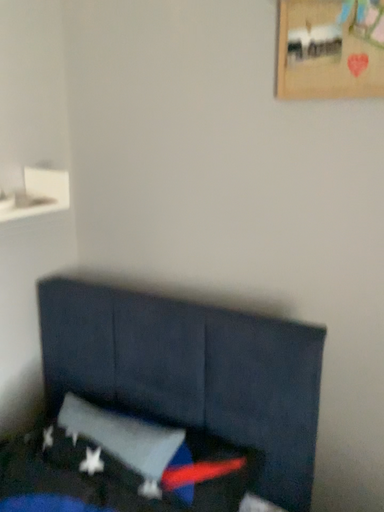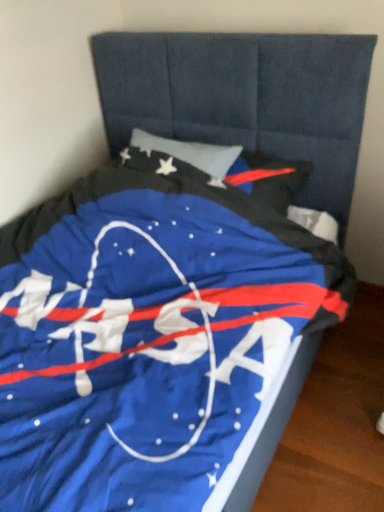
Question: Which way did the camera rotate in the video?

Choices:
 (A) rotated downward
 (B) rotated upward

Answer: (A)